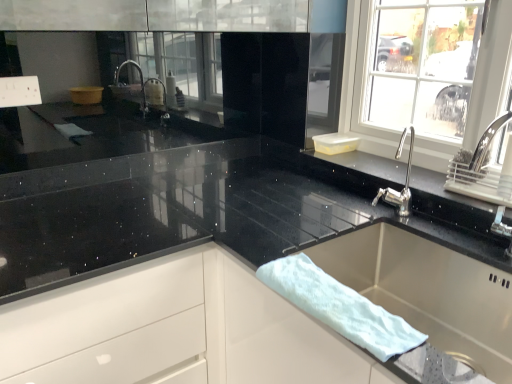
What do you see at coordinates (340, 307) in the screenshot? I see `white fluffy bath towel at sink` at bounding box center [340, 307].

Locate an element on the screen. The image size is (512, 384). white glossy drawer at center is located at coordinates (108, 326).

You are a GUI agent. You are given a task and a screenshot of the screen. Output one action in this format:
    pyautogui.click(x=<x>, y=<y>)
    Task: Click on the white fluffy bath towel at sink
    The width and height of the screenshot is (512, 384).
    Given the screenshot: What is the action you would take?
    pyautogui.click(x=340, y=307)

How many degrees apart are the facing directions of white fluffy bath towel at sink and white glossy drawer at center?

white fluffy bath towel at sink and white glossy drawer at center are facing 89 degrees away from each other.

Looking at this image, considering the sizes of objects white fluffy bath towel at sink and white glossy drawer at center in the image provided, who is taller, white fluffy bath towel at sink or white glossy drawer at center?

white glossy drawer at center.

Considering the relative positions of white fluffy bath towel at sink and white glossy drawer at center in the image provided, is white fluffy bath towel at sink to the right of white glossy drawer at center from the viewer's perspective?

Yes.

Is white fluffy bath towel at sink with white glossy drawer at center?

white fluffy bath towel at sink is not next to white glossy drawer at center, and they're not touching.

Would you say white fluffy bath towel at sink contains stainless steel sink at lower right?

No, stainless steel sink at lower right is not inside white fluffy bath towel at sink.

Which is more to the left, white fluffy bath towel at sink or stainless steel sink at lower right?

Positioned to the left is white fluffy bath towel at sink.

Locate an element on the screen. This screenshot has height=384, width=512. sink to the right of white fluffy bath towel at sink is located at coordinates (429, 291).

Can you confirm if white fluffy bath towel at sink is bigger than stainless steel sink at lower right?

No, white fluffy bath towel at sink is not bigger than stainless steel sink at lower right.

The image size is (512, 384). In order to click on sink behind the white fluffy bath towel at sink in this screenshot , I will do `click(429, 291)`.

Who is taller, stainless steel sink at lower right or white fluffy bath towel at sink?

Standing taller between the two is stainless steel sink at lower right.

Between stainless steel sink at lower right and white fluffy bath towel at sink, which one has smaller size?

Smaller between the two is white fluffy bath towel at sink.

From a real-world perspective, is stainless steel sink at lower right physically located above or below white fluffy bath towel at sink?

From a real-world perspective, stainless steel sink at lower right is physically below white fluffy bath towel at sink.

From a real-world perspective, between white glossy drawer at center and stainless steel sink at lower right, who is vertically higher?

stainless steel sink at lower right is physically above.

Is white glossy drawer at center positioned with its back to stainless steel sink at lower right?

white glossy drawer at center is not turned away from stainless steel sink at lower right.

Is white glossy drawer at center inside or outside of stainless steel sink at lower right?

white glossy drawer at center is outside stainless steel sink at lower right.

Which object is positioned more to the left, white glossy drawer at center or stainless steel sink at lower right?

white glossy drawer at center.

What's the angular difference between white glossy drawer at center and white fluffy bath towel at sink's facing directions?

They differ by 89 degrees in their facing directions.

Is white glossy drawer at center directly adjacent to white fluffy bath towel at sink?

No, white glossy drawer at center is not in contact with white fluffy bath towel at sink.

Between white glossy drawer at center and white fluffy bath towel at sink, which one has larger size?

Bigger between the two is white glossy drawer at center.

From the image's perspective, is white glossy drawer at center on white fluffy bath towel at sink?

No.

Who is taller, stainless steel sink at lower right or white glossy drawer at center?

white glossy drawer at center.

How different are the orientations of stainless steel sink at lower right and white glossy drawer at center in degrees?

There is a 89-degree angle between the facing directions of stainless steel sink at lower right and white glossy drawer at center.

Which object is more forward, stainless steel sink at lower right or white glossy drawer at center?

stainless steel sink at lower right is closer to the camera.

Image resolution: width=512 pixels, height=384 pixels. What are the coordinates of `drawer below the white fluffy bath towel at sink (from a real-world perspective)` in the screenshot? It's located at (108, 326).

Identify the location of bath towel in front of the stainless steel sink at lower right. (340, 307).

Which object lies further to the anchor point white glossy drawer at center, white fluffy bath towel at sink or stainless steel sink at lower right?

stainless steel sink at lower right lies further to white glossy drawer at center than the other object.

Based on their spatial positions, is white glossy drawer at center or white fluffy bath towel at sink further from stainless steel sink at lower right?

Among the two, white glossy drawer at center is located further to stainless steel sink at lower right.

When comparing their distances from white glossy drawer at center, does stainless steel sink at lower right or white fluffy bath towel at sink seem further?

stainless steel sink at lower right lies further to white glossy drawer at center than the other object.

Which object lies further to the anchor point white fluffy bath towel at sink, white glossy drawer at center or stainless steel sink at lower right?

white glossy drawer at center is further to white fluffy bath towel at sink.

In the scene shown: Estimate the real-world distances between objects in this image. Which object is closer to stainless steel sink at lower right, white fluffy bath towel at sink or white glossy drawer at center?

The object closer to stainless steel sink at lower right is white fluffy bath towel at sink.

Looking at the image, which one is located further to white fluffy bath towel at sink, stainless steel sink at lower right or white glossy drawer at center?

Among the two, white glossy drawer at center is located further to white fluffy bath towel at sink.

Where is `bath towel between white glossy drawer at center and stainless steel sink at lower right`? This screenshot has height=384, width=512. bath towel between white glossy drawer at center and stainless steel sink at lower right is located at coordinates (340, 307).